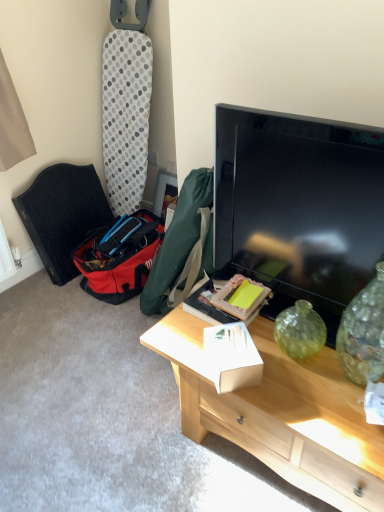
You are a GUI agent. You are given a task and a screenshot of the screen. Output one action in this format:
    pyautogui.click(x=<x>, y=<y>)
    Task: Click on the free spot above white cardboard box at center, arranged as the first box when viewed from the front (from a real-world perspective)
    Image resolution: width=384 pixels, height=512 pixels.
    Given the screenshot: What is the action you would take?
    pyautogui.click(x=233, y=344)